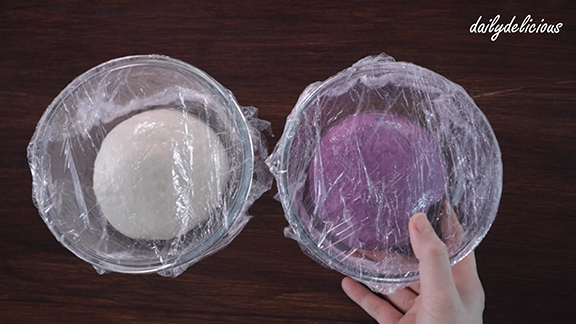
This screenshot has height=324, width=576. I want to click on left bowl, so pos(159,183).